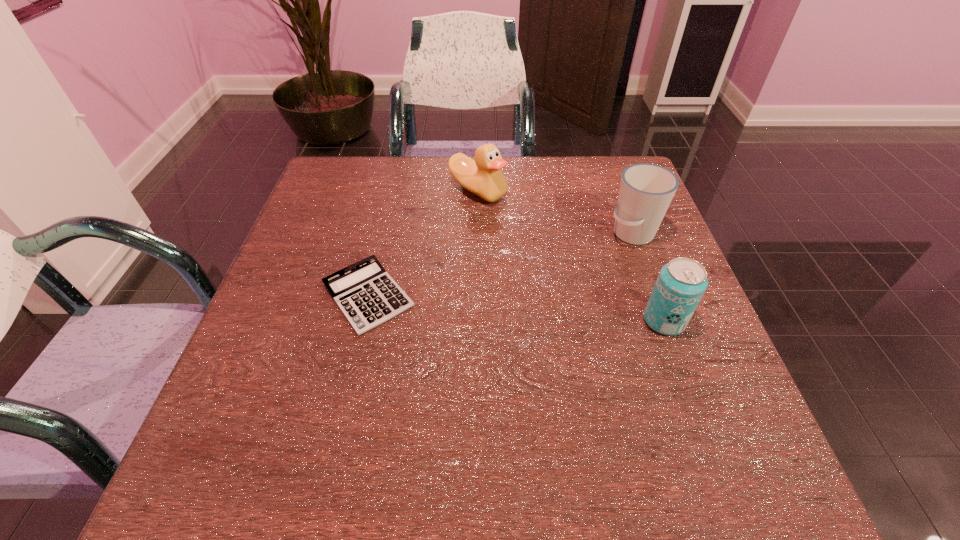
Identify the location of the leftmost object. This screenshot has height=540, width=960. (366, 294).

Locate an element on the screen. Image resolution: width=960 pixels, height=540 pixels. calculator is located at coordinates (366, 294).

The width and height of the screenshot is (960, 540). In order to click on beer can in this screenshot , I will do `click(681, 283)`.

Where is `the second farthest object`? the second farthest object is located at coordinates (646, 190).

Where is `duck`? This screenshot has height=540, width=960. duck is located at coordinates (483, 176).

The image size is (960, 540). Identify the location of the third object from right to left. (483, 176).

The width and height of the screenshot is (960, 540). What are the coordinates of `vacant area situated 0.090m on the back of the leftmost object` in the screenshot? It's located at (382, 236).

At what (x,y) coordinates should I click in order to perform the action: click on blank area located 0.140m on the back of the beer can. Please return your answer as a coordinate pair (x, y). The image size is (960, 540). Looking at the image, I should click on (641, 259).

The image size is (960, 540). In order to click on vacant space located 0.050m with a handle on the side of the cup in this screenshot , I will do `click(598, 252)`.

The image size is (960, 540). I want to click on vacant area situated with a handle on the side of the cup, so click(x=550, y=279).